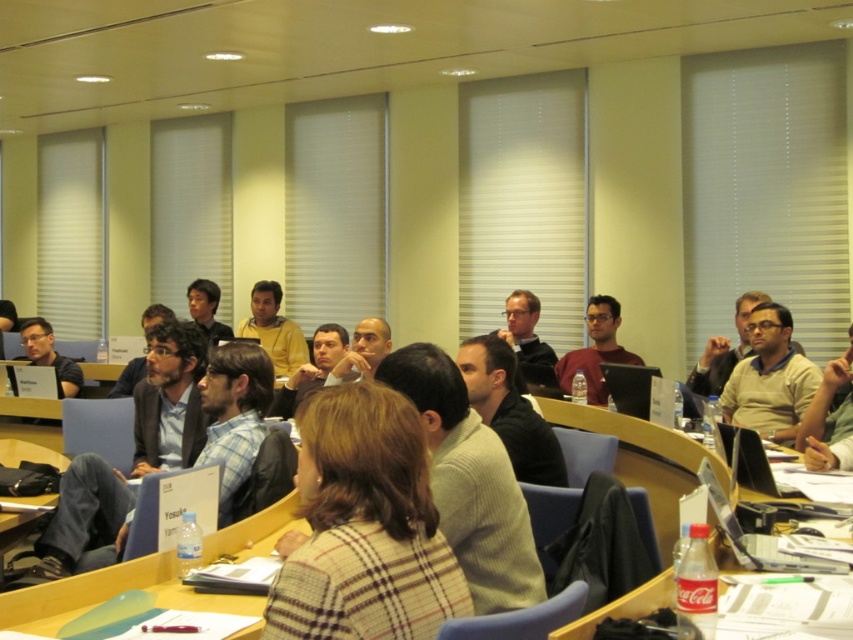
Question: Which point is farther to the camera?

Choices:
 (A) matte beige sweater at center
 (B) white paper at center
 (C) wooden table at center
 (D) plaid wool sweater at center

Answer: (A)

Question: Which object is farther from the camera taking this photo?

Choices:
 (A) plaid wool sweater at center
 (B) light brown sweater at center
 (C) light brown shirt at center
 (D) white paper at center

Answer: (B)

Question: Does plaid wool sweater at center appear under matte black laptop at center?

Choices:
 (A) no
 (B) yes

Answer: (B)

Question: Is wooden table at center behind light brown sweater at center?

Choices:
 (A) no
 (B) yes

Answer: (A)

Question: Can you confirm if matte black laptop at center is positioned below yellow sweater at center?

Choices:
 (A) yes
 (B) no

Answer: (A)

Question: Which point appears farthest from the camera in this image?

Choices:
 (A) (820, 403)
 (B) (155, 588)
 (C) (601, 353)

Answer: (C)